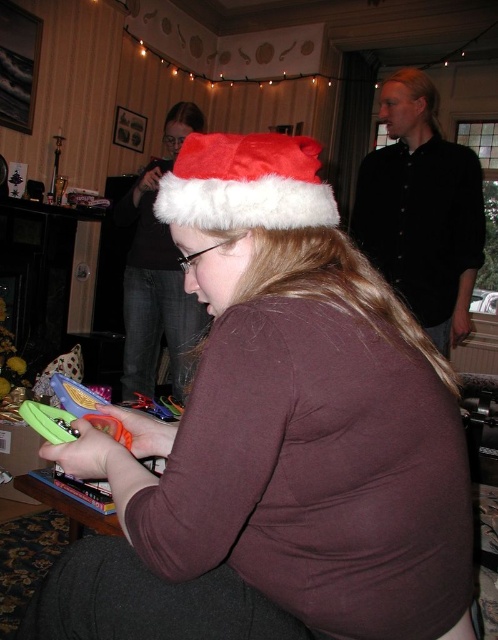
Consider the image. You are a photographer trying to capture a clear shot of both the seated person and the background. You notice two points in the image at coordinates point (376,284) and point (281,221). Which point should you focus on to ensure both areas are in focus?

You should focus on point (376,284) because it is further to the camera than point (281,221), ensuring both the foreground and background are in focus.